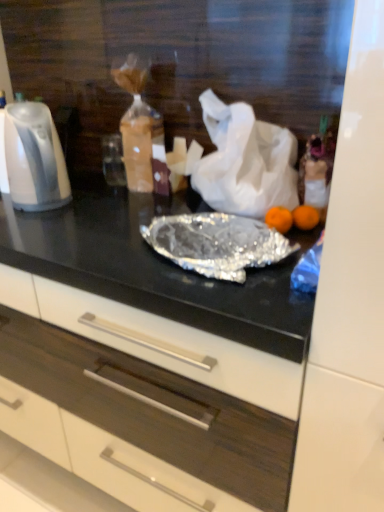
The image size is (384, 512). Describe the element at coordinates (132, 414) in the screenshot. I see `white matte drawer at center` at that location.

Identify the location of white glossy electric kettle at left. The width and height of the screenshot is (384, 512). (34, 158).

This screenshot has height=512, width=384. What are the coordinates of `white matte drawer at center` in the screenshot? It's located at (132, 414).

From the image's perspective, is white matte plastic bag at center above or below white glossy electric kettle at left?

white matte plastic bag at center is situated higher than white glossy electric kettle at left in the image.

Could you tell me if white matte plastic bag at center is turned towards white glossy electric kettle at left?

No, white matte plastic bag at center is not aimed at white glossy electric kettle at left.

Measure the distance between white matte plastic bag at center and white glossy electric kettle at left.

The distance of white matte plastic bag at center from white glossy electric kettle at left is 18.93 inches.

Does point (227, 117) come farther from viewer compared to point (60, 170)?

No.

How different are the orientations of white matte drawer at center and white matte plastic bag at center in degrees?

0.000617 degrees separate the facing orientations of white matte drawer at center and white matte plastic bag at center.

Where is `plastic bag behind the white matte drawer at center`? This screenshot has width=384, height=512. plastic bag behind the white matte drawer at center is located at coordinates (245, 161).

Does white matte drawer at center have a lesser width compared to white matte plastic bag at center?

In fact, white matte drawer at center might be wider than white matte plastic bag at center.

Is white matte drawer at center facing towards white matte plastic bag at center?

No, white matte drawer at center is not facing towards white matte plastic bag at center.

Is the surface of white matte drawer at center in direct contact with white glossy electric kettle at left?

No, white matte drawer at center is not in contact with white glossy electric kettle at left.

Does white matte drawer at center lie behind white glossy electric kettle at left?

No, it is in front of white glossy electric kettle at left.

Does point (118, 485) come closer to viewer compared to point (5, 155)?

Yes, point (118, 485) is in front of point (5, 155).

Considering the sizes of objects white matte drawer at center and white glossy electric kettle at left in the image provided, who is smaller, white matte drawer at center or white glossy electric kettle at left?

white glossy electric kettle at left is smaller.

Is point (22, 153) more distant than point (234, 469)?

Yes, it is.

At what (x,y) coordinates should I click in order to perform the action: click on kitchen appliance lying above the white matte drawer at center (from the image's perspective). Please return your answer as a coordinate pair (x, y). Looking at the image, I should click on (34, 158).

Is white glossy electric kettle at left with white matte drawer at center?

No, white glossy electric kettle at left is not in contact with white matte drawer at center.

Is white glossy electric kettle at left inside or outside of white matte drawer at center?

white glossy electric kettle at left is not inside white matte drawer at center, it's outside.

Between white matte plastic bag at center and white matte drawer at center, which one has smaller width?

white matte plastic bag at center is thinner.

From the image's perspective, which object appears higher, white matte plastic bag at center or white matte drawer at center?

white matte plastic bag at center is shown above in the image.

Who is shorter, white matte plastic bag at center or white matte drawer at center?

Standing shorter between the two is white matte plastic bag at center.

Are white glossy electric kettle at left and white matte plastic bag at center far apart?

No, there isn't a large distance between white glossy electric kettle at left and white matte plastic bag at center.

Is white glossy electric kettle at left closer to camera compared to white matte plastic bag at center?

No, white glossy electric kettle at left is further to the viewer.

Which of these two, white glossy electric kettle at left or white matte plastic bag at center, is bigger?

white matte plastic bag at center.

Where is `plastic bag above the white glossy electric kettle at left (from a real-world perspective)`? plastic bag above the white glossy electric kettle at left (from a real-world perspective) is located at coordinates (245, 161).

This screenshot has height=512, width=384. In the image, there is a white matte plastic bag at center. What are the coordinates of `drawer below it (from the image's perspective)` in the screenshot? It's located at (132, 414).

Looking at the image, which one is located further to white glossy electric kettle at left, white matte drawer at center or white matte plastic bag at center?

white matte drawer at center.

Considering their positions, is white matte plastic bag at center positioned closer to white matte drawer at center than white glossy electric kettle at left?

white glossy electric kettle at left is positioned closer to the anchor white matte drawer at center.

Based on their spatial positions, is white glossy electric kettle at left or white matte plastic bag at center further from white matte drawer at center?

Among the two, white matte plastic bag at center is located further to white matte drawer at center.

Which object lies nearer to the anchor point white glossy electric kettle at left, white matte plastic bag at center or white matte drawer at center?

white matte plastic bag at center.

Estimate the real-world distances between objects in this image. Which object is closer to white matte plastic bag at center, white glossy electric kettle at left or white matte drawer at center?

Among the two, white glossy electric kettle at left is located nearer to white matte plastic bag at center.

Looking at the image, which one is located further to white matte plastic bag at center, white matte drawer at center or white glossy electric kettle at left?

The object further to white matte plastic bag at center is white matte drawer at center.

Where is `kitchen appliance between white matte plastic bag at center and white matte drawer at center from top to bottom`? This screenshot has height=512, width=384. kitchen appliance between white matte plastic bag at center and white matte drawer at center from top to bottom is located at coordinates (34, 158).